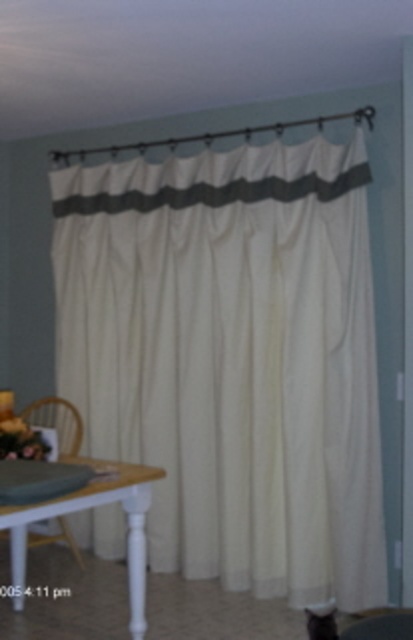
You are standing in the room depicted in the image. There is a point labeled as point (232, 358). Based on the scene description, what object does this point most likely belong to?

The point (232, 358) corresponds to the white textured curtain at center.

You are sitting on the wooden armchair at lower left and want to pet the fluffy white cat at lower center. Can you reach the cat without moving from your seat?

The wooden armchair at lower left is positioned under the fluffy white cat at lower center, so yes, you can reach the cat without moving from your seat.

You are standing in the room and want to place a small plant exactly at point (232, 358). What object will the plant be placed on or near?

The small plant placed at point (232, 358) will be on or near the white textured curtain at center.